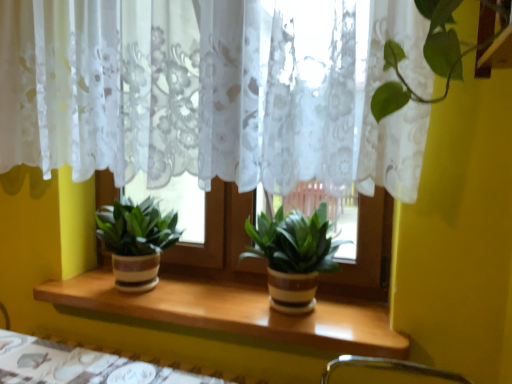
Identify the location of vacant space to the left of green matte plant at center, which is the 2th houseplant in left-to-right order. This screenshot has height=384, width=512. (206, 301).